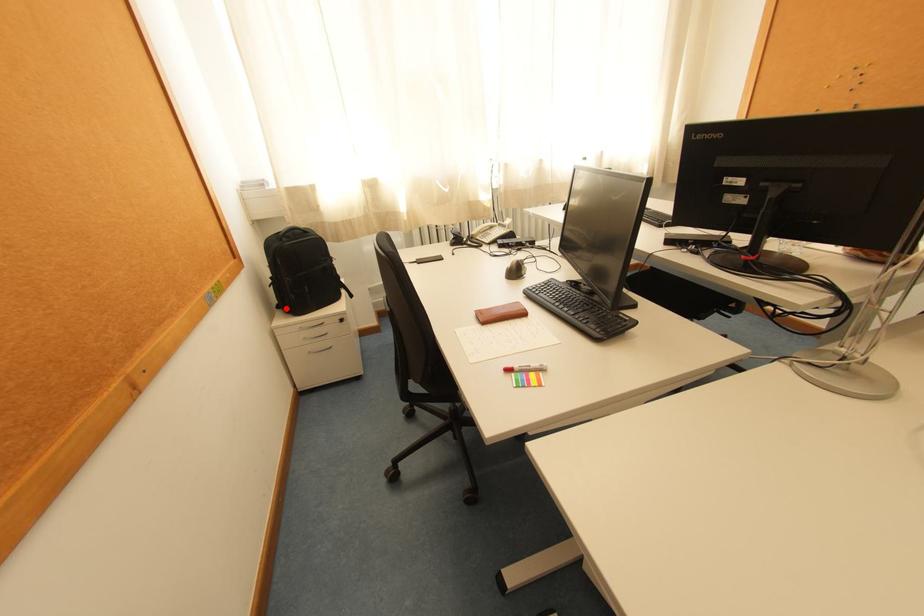
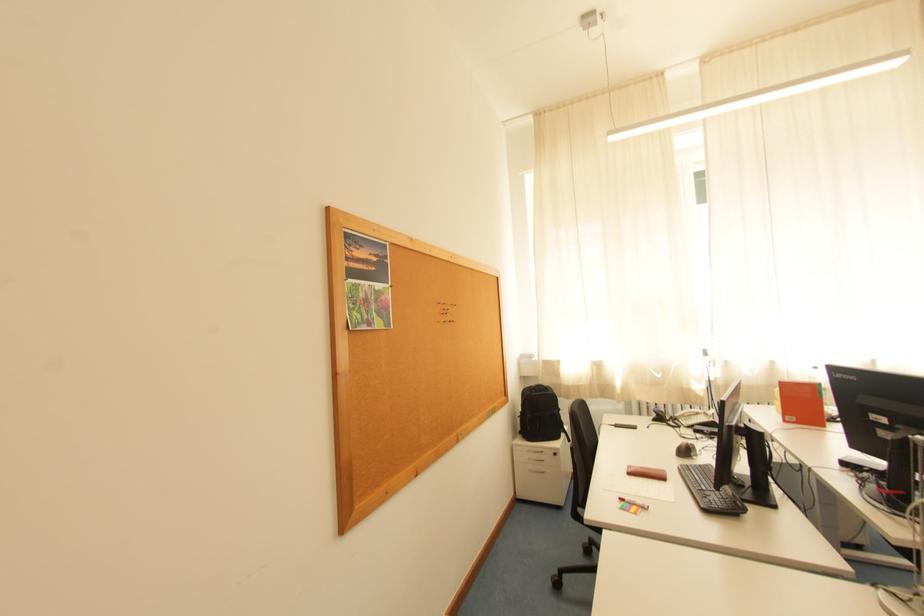
Question: I am providing you with two images of the same scene from different viewpoints. A red point is shown in image1. For the corresponding object point in image2, is it positioned nearer or farther from the camera?

Choices:
 (A) Nearer
 (B) Farther

Answer: (B)